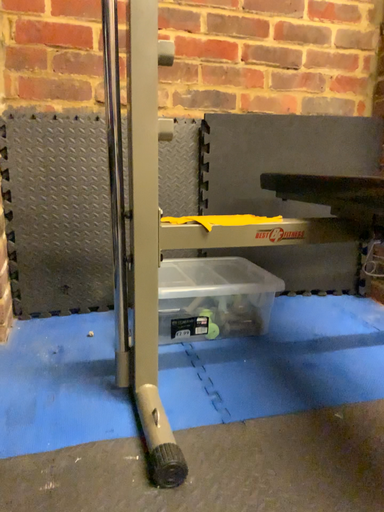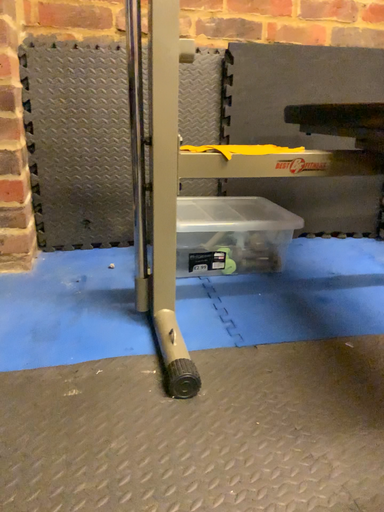
Question: How did the camera likely rotate when shooting the video?

Choices:
 (A) rotated upward
 (B) rotated downward

Answer: (B)